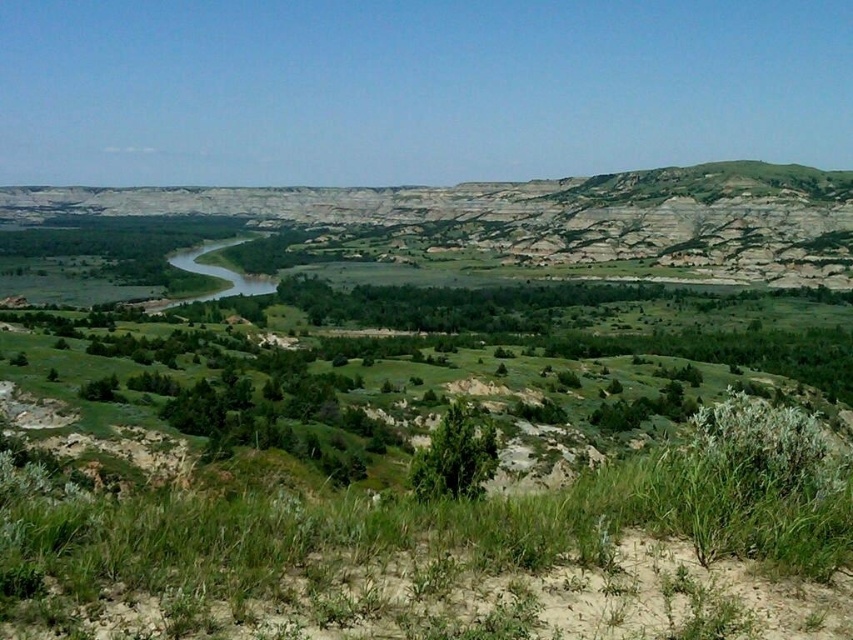
Question: Which of the following is the farthest from the observer?

Choices:
 (A) (442, 458)
 (B) (456, 228)

Answer: (B)

Question: Which of the following is the closest to the observer?

Choices:
 (A) green leafy bush at center
 (B) rugged stone mountain at center

Answer: (A)

Question: Does rugged stone mountain at center have a lesser width compared to green leafy bush at center?

Choices:
 (A) yes
 (B) no

Answer: (B)

Question: Does rugged stone mountain at center have a greater width compared to green leafy bush at center?

Choices:
 (A) yes
 (B) no

Answer: (A)

Question: Does rugged stone mountain at center appear on the right side of green leafy bush at center?

Choices:
 (A) yes
 (B) no

Answer: (B)

Question: Which point appears farthest from the camera in this image?

Choices:
 (A) tap(479, 445)
 (B) tap(45, 211)

Answer: (B)